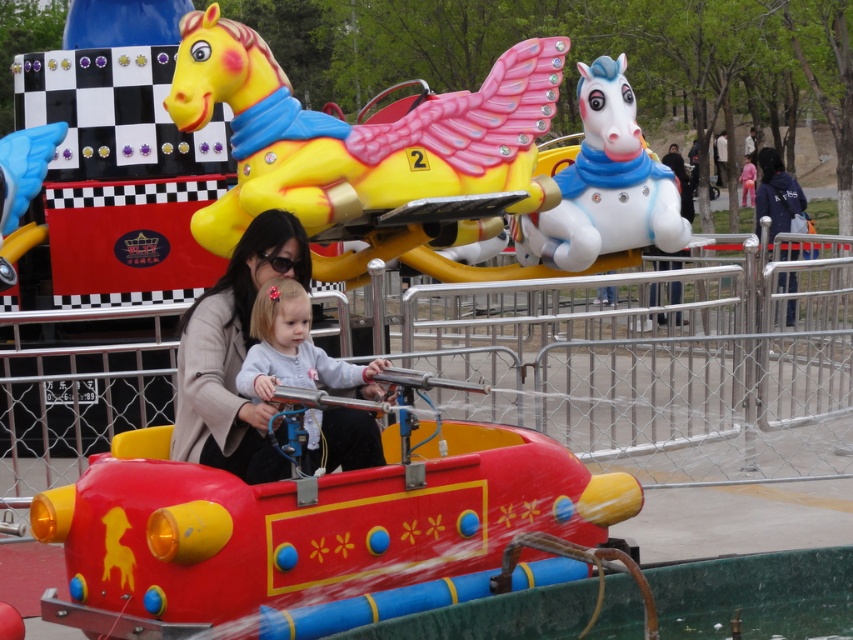
Question: Is white glossy horse at upper center smaller than light gray fleece jacket at center?

Choices:
 (A) no
 (B) yes

Answer: (A)

Question: Among these objects, which one is farthest from the camera?

Choices:
 (A) white glossy horse at upper center
 (B) shiny plastic boat at center
 (C) matte beige coat at center
 (D) light gray fleece jacket at center

Answer: (A)

Question: Which object appears closest to the camera in this image?

Choices:
 (A) shiny plastic boat at center
 (B) white glossy horse at upper center
 (C) yellow matte plastic horse at upper center

Answer: (A)

Question: Which point appears closest to the camera in this image?

Choices:
 (A) (633, 140)
 (B) (392, 250)

Answer: (B)

Question: From the image, what is the correct spatial relationship of shiny plastic boat at center in relation to white glossy horse at upper center?

Choices:
 (A) below
 (B) above

Answer: (A)

Question: Can you confirm if shiny plastic boat at center is wider than matte beige coat at center?

Choices:
 (A) yes
 (B) no

Answer: (A)